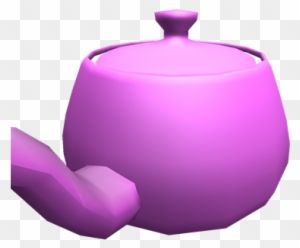
In order to click on handle in this screenshot , I will do `click(173, 14)`.